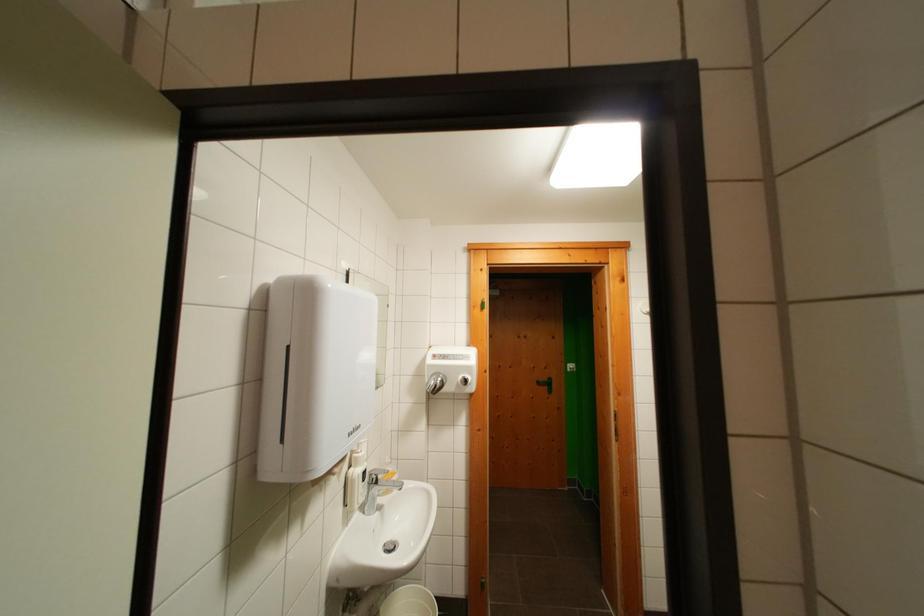
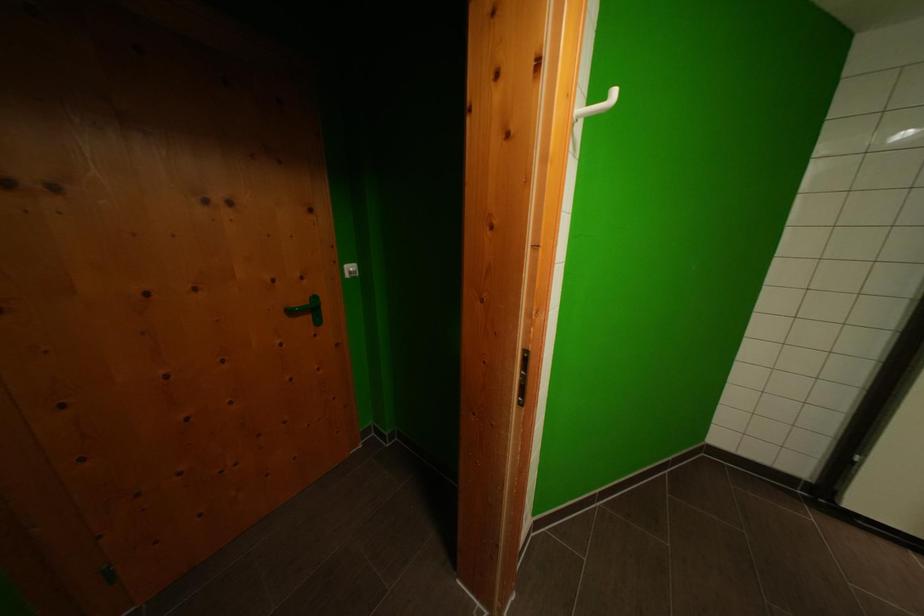
Where in the second image is the point corresponding to (x=544, y=387) from the first image?

(297, 315)